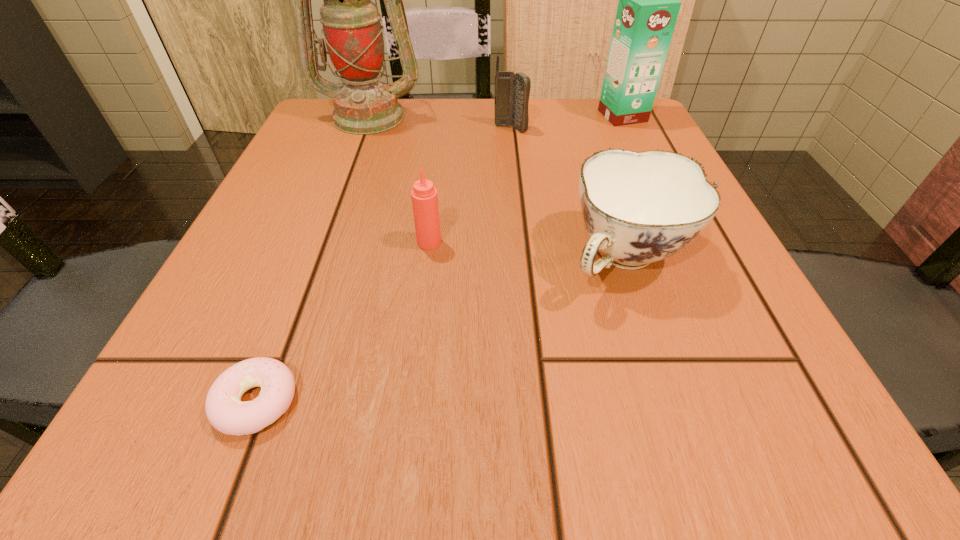
Identify the location of chinaware that is at the right edge. The height and width of the screenshot is (540, 960). (639, 207).

The width and height of the screenshot is (960, 540). I want to click on object that is at the far left corner, so click(x=353, y=34).

Identify the location of object that is at the near left corner. (225, 411).

Find the location of a particular element. object positioned at the far right corner is located at coordinates (648, 7).

The height and width of the screenshot is (540, 960). Identify the location of vacant space at the far edge of the desktop. (449, 103).

In the image, there is a desktop. Where is `vacant space at the near edge`? vacant space at the near edge is located at coordinates (524, 408).

Identify the location of vacant region at the left edge of the desktop. (252, 220).

Locate an element on the screen. free space at the right edge of the desktop is located at coordinates (708, 340).

Where is `vacant area at the far left corner`? This screenshot has height=540, width=960. vacant area at the far left corner is located at coordinates (323, 136).

The width and height of the screenshot is (960, 540). I want to click on free space at the far right corner of the desktop, so click(585, 130).